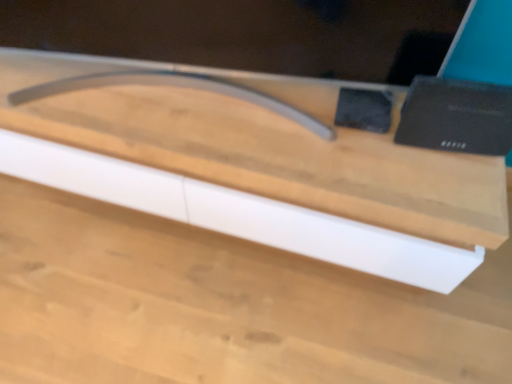
What do you see at coordinates (259, 169) in the screenshot?
I see `wooden shelf at center` at bounding box center [259, 169].

Where is `wooden shelf at center`? This screenshot has width=512, height=384. wooden shelf at center is located at coordinates (259, 169).

What are the coordinates of `wooden shelf at center` in the screenshot? It's located at (259, 169).